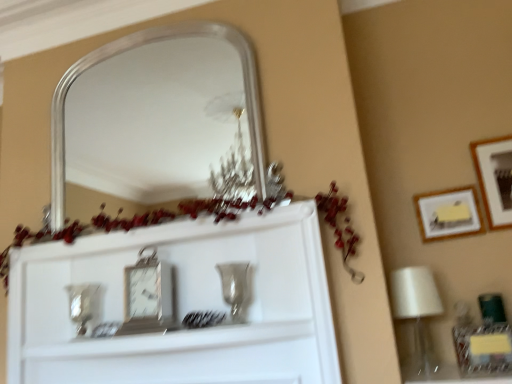
Question: Considering the relative positions of metallic silver clock at center and silver/metallic mirror at upper center in the image provided, is metallic silver clock at center to the left or to the right of silver/metallic mirror at upper center?

Choices:
 (A) right
 (B) left

Answer: (A)

Question: In terms of size, does metallic silver clock at center appear bigger or smaller than silver/metallic mirror at upper center?

Choices:
 (A) small
 (B) big

Answer: (A)

Question: Estimate the real-world distances between objects in this image. Which object is farther from the matte yellow paper at upper right, the 2th picture frame when ordered from right to left?

Choices:
 (A) wooden framed picture at right, which is counted as the 1th picture frame, starting from the right
 (B) metallic rectangular clock at center
 (C) silver/metallic mirror at upper center
 (D) white glossy lampshade at right
 (E) metallic silver clock at center

Answer: (C)

Question: Which of these objects is positioned farthest from the matte yellow paper at upper right, the 2th picture frame when ordered from right to left?

Choices:
 (A) metallic silver clock at center
 (B) wooden framed picture at right, which is counted as the 1th picture frame, starting from the right
 (C) white glossy lampshade at right
 (D) metallic rectangular clock at center
 (E) silver/metallic mirror at upper center

Answer: (E)